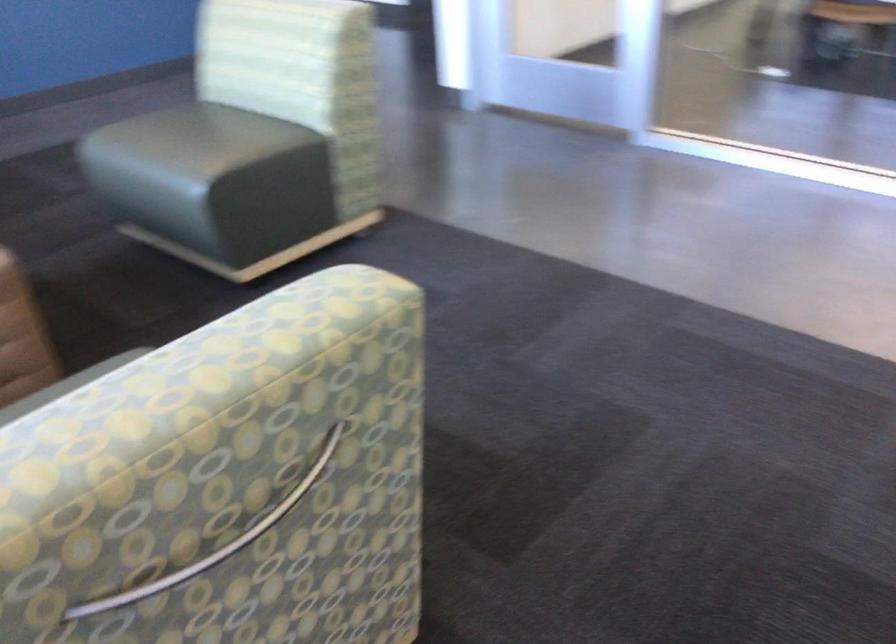
The width and height of the screenshot is (896, 644). In order to click on green chair sitting surface in this screenshot , I will do `click(192, 143)`.